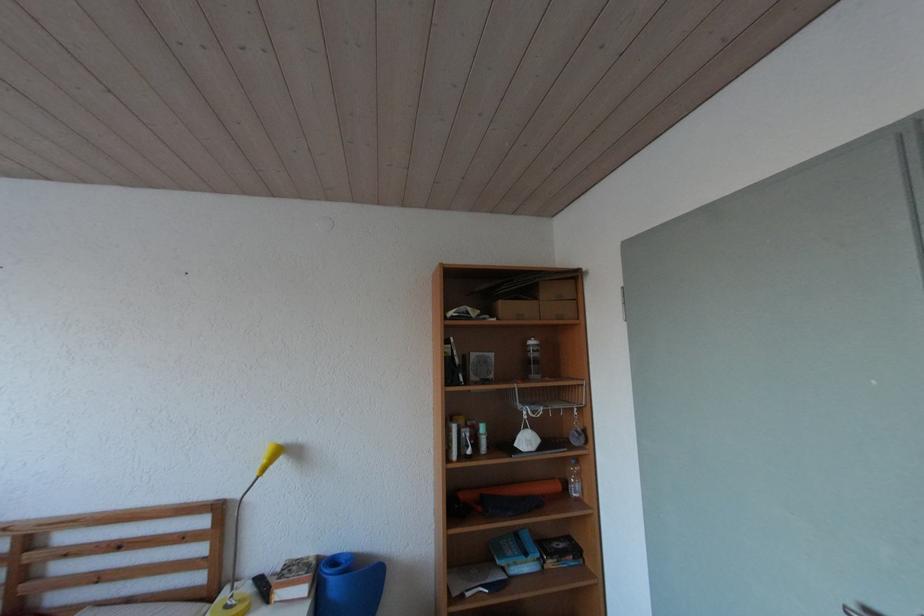
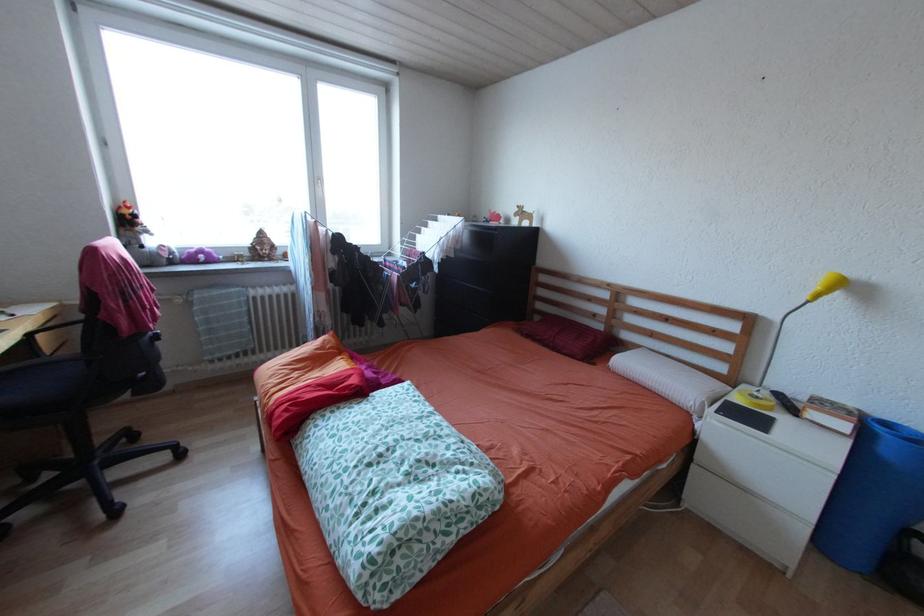
Based on the continuous images, in which direction is the camera rotating?

The camera rotated toward left-down.